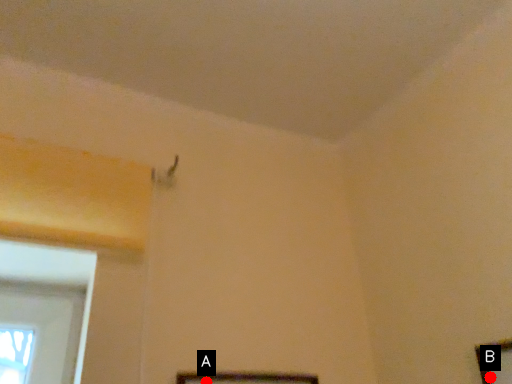
Question: Two points are circled on the image, labeled by A and B beside each circle. Which point appears closest to the camera in this image?

Choices:
 (A) A is closer
 (B) B is closer

Answer: (B)